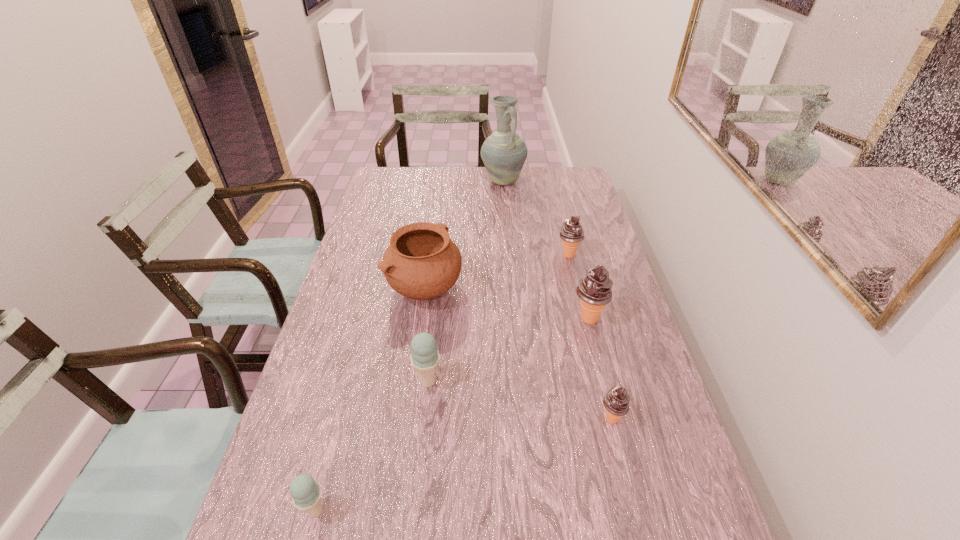
Locate an element on the screen. This screenshot has height=540, width=960. the fourth object from left to right is located at coordinates (504, 152).

At what (x,y) coordinates should I click in order to perform the action: click on the tallest object. Please return your answer as a coordinate pair (x, y). Looking at the image, I should click on click(504, 152).

This screenshot has width=960, height=540. In order to click on the tallest ice cream in this screenshot , I will do `click(594, 290)`.

Find the location of a particular element. The image size is (960, 540). the second farthest ice cream is located at coordinates (594, 290).

In order to click on pottery in this screenshot , I will do `click(422, 262)`.

Find the location of a particular element. The width and height of the screenshot is (960, 540). the second farthest object is located at coordinates (571, 233).

In order to click on the farthest chocolate icecream in this screenshot , I will do `click(571, 233)`.

Find the location of a particular element. This screenshot has width=960, height=540. the second ice cream from left to right is located at coordinates (425, 357).

The image size is (960, 540). Find the location of `the third nearest ice cream`. the third nearest ice cream is located at coordinates (425, 357).

This screenshot has width=960, height=540. Find the location of `the fourth farthest ice cream`. the fourth farthest ice cream is located at coordinates (616, 401).